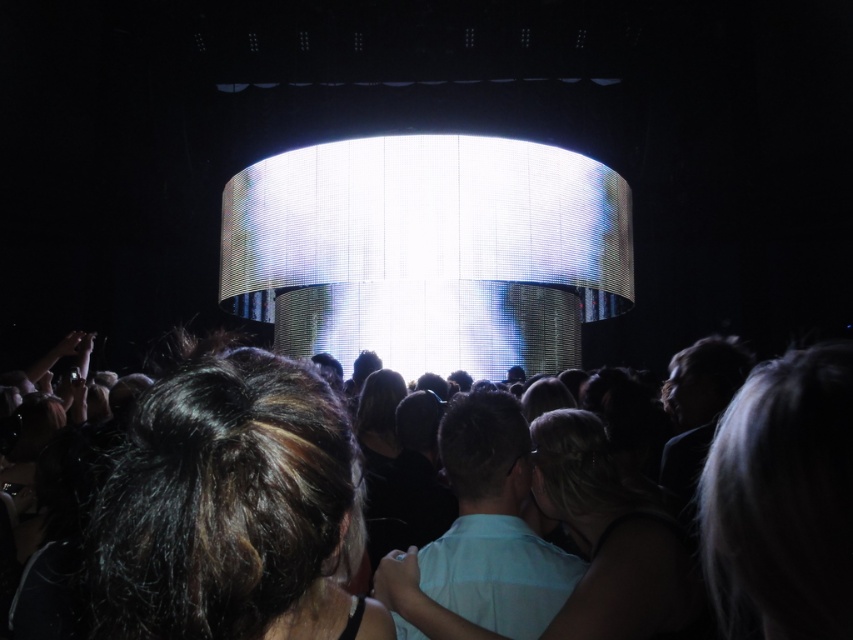
Who is higher up, dark brown hair at center or silvery hair at center?

silvery hair at center is above.

Does dark brown hair at center have a greater height compared to silvery hair at center?

In fact, dark brown hair at center may be shorter than silvery hair at center.

This screenshot has width=853, height=640. I want to click on dark brown hair at center, so click(x=231, y=509).

At what (x,y) coordinates should I click in order to perform the action: click on dark brown hair at center. Please return your answer as a coordinate pair (x, y). Image resolution: width=853 pixels, height=640 pixels. Looking at the image, I should click on (231, 509).

Between point (821, 394) and point (115, 621), which one is positioned behind?

The point (821, 394) is behind.

Does silvery hair at center have a larger size compared to dark hair at center?

Actually, silvery hair at center might be smaller than dark hair at center.

Which is in front, point (782, 609) or point (157, 440)?

Positioned in front is point (157, 440).

You are a GUI agent. You are given a task and a screenshot of the screen. Output one action in this format:
    pyautogui.click(x=<x>, y=<y>)
    Task: Click on the silvery hair at center
    
    Given the screenshot: What is the action you would take?
    pyautogui.click(x=782, y=499)

Consider the image. Which is above, dark brown hair at center or dark hair at center?

dark brown hair at center is above.

Locate an element on the screen. dark brown hair at center is located at coordinates (231, 509).